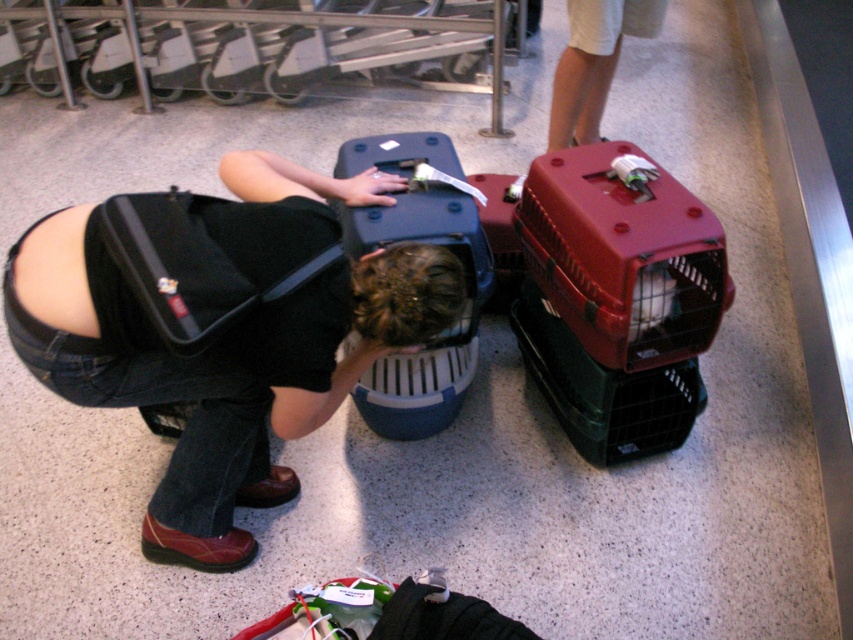
Question: Which point appears farthest from the camera in this image?

Choices:
 (A) (233, 449)
 (B) (345, 208)

Answer: (B)

Question: Is translucent plastic pet carrier at center to the left of white cotton shorts at upper center from the viewer's perspective?

Choices:
 (A) yes
 (B) no

Answer: (A)

Question: Based on their relative distances, which object is farther from the translucent plastic pet carrier at center?

Choices:
 (A) white cotton shorts at upper center
 (B) black matte suitcase at center

Answer: (A)

Question: Considering the relative positions of translucent plastic pet carrier at center and white cotton shorts at upper center in the image provided, where is translucent plastic pet carrier at center located with respect to white cotton shorts at upper center?

Choices:
 (A) below
 (B) above

Answer: (A)

Question: Is black matte suitcase at center positioned at the back of white cotton shorts at upper center?

Choices:
 (A) no
 (B) yes

Answer: (A)

Question: Estimate the real-world distances between objects in this image. Which object is farther from the black matte suitcase at center?

Choices:
 (A) translucent plastic pet carrier at center
 (B) white cotton shorts at upper center

Answer: (B)